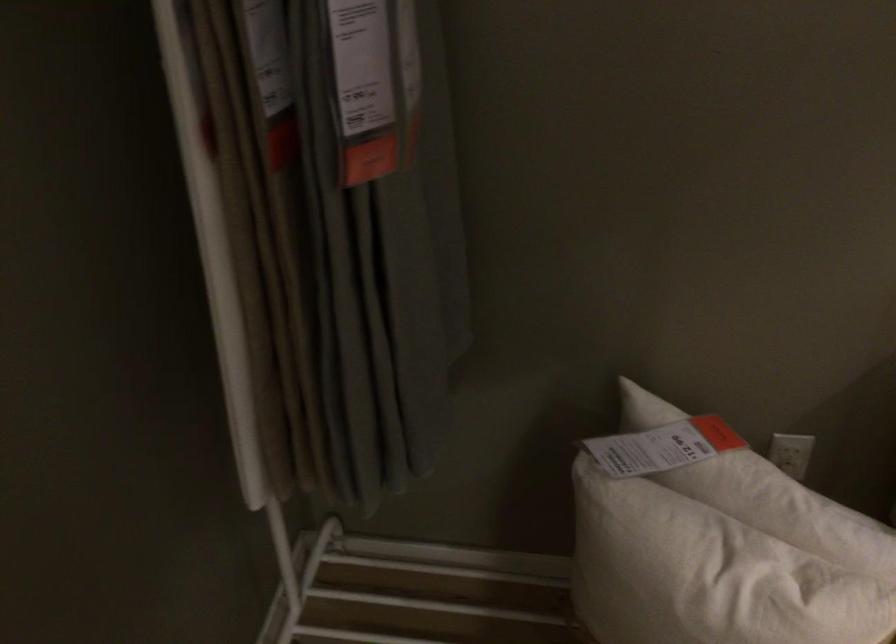
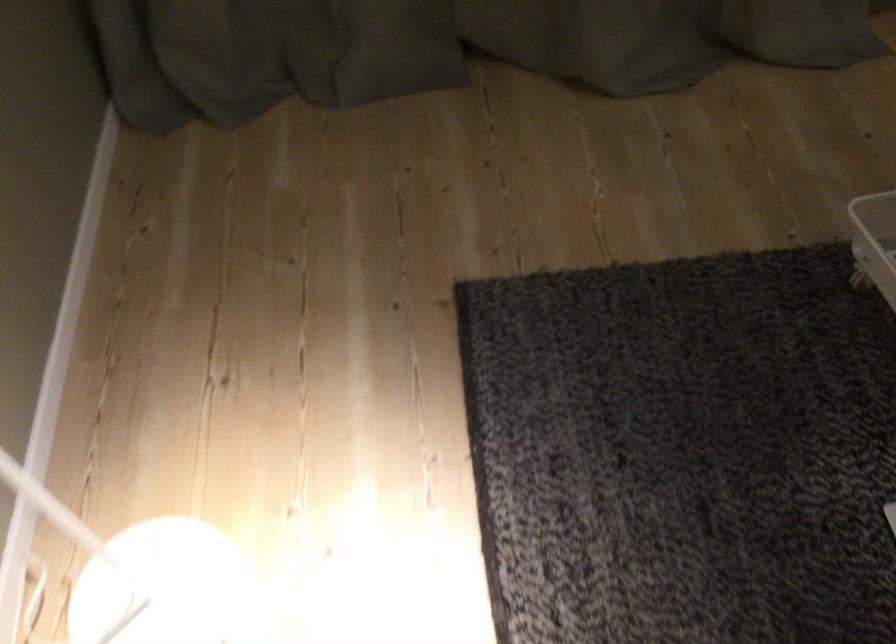
The images are taken continuously from a first-person perspective. In which direction is your viewpoint rotating?

The camera's rotation is toward right-down.